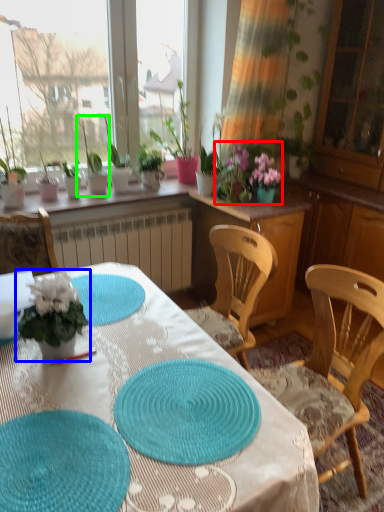
Question: Estimate the real-world distances between objects in this image. Which object is farther from floral arrangement (highlighted by a red box), houseplant (highlighted by a blue box) or houseplant (highlighted by a green box)?

Choices:
 (A) houseplant
 (B) houseplant

Answer: (A)